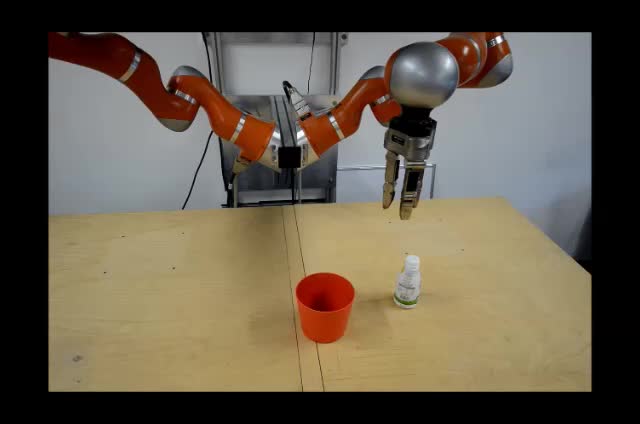
At what (x,y) coordinates should I click in order to perform the action: click on wall. Please return your answer as a coordinate pair (x, y). The image size is (640, 424). Looking at the image, I should click on (125, 145).